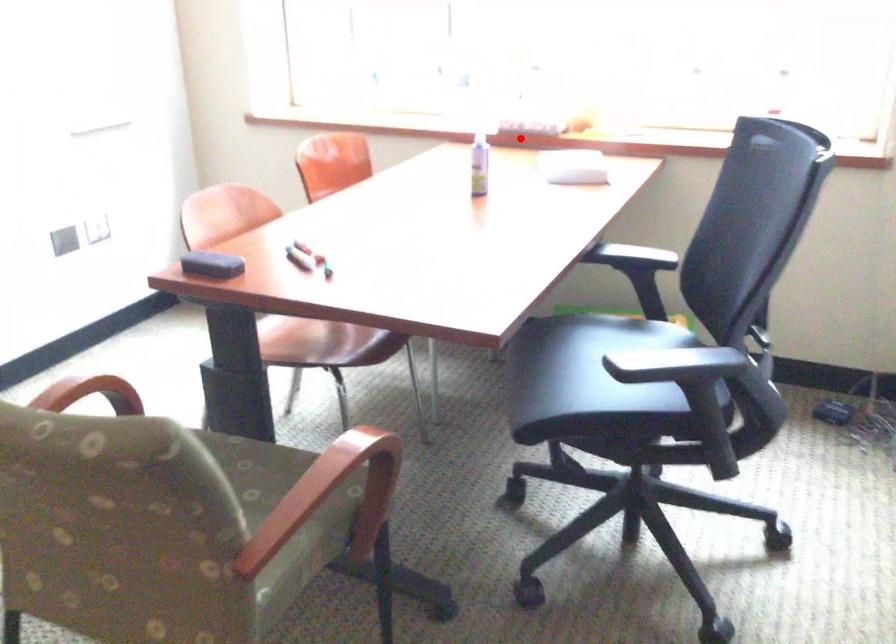
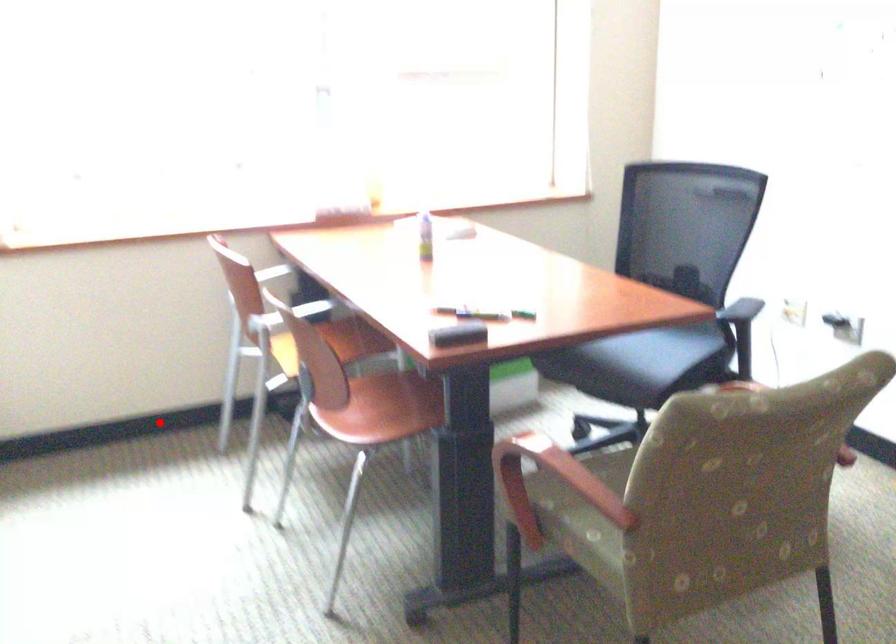
I am providing you with two images of the same scene from different viewpoints. A red point is marked on the first image and another point is marked on the second image. Is the marked point in image1 the same physical position as the marked point in image2?

No